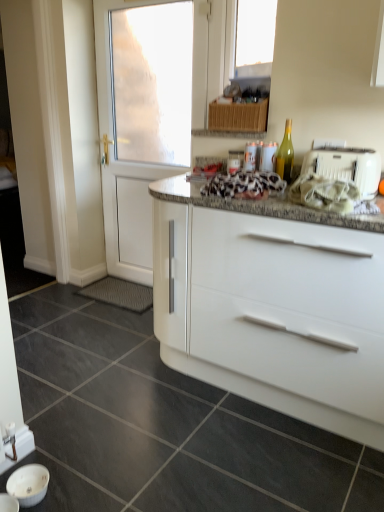
Image resolution: width=384 pixels, height=512 pixels. I want to click on granite at center, so click(x=163, y=425).

Measure the distance between point (x=236, y=58) and camera.

Point (x=236, y=58) and camera are 2.25 meters apart from each other.

The width and height of the screenshot is (384, 512). Describe the element at coordinates (108, 55) in the screenshot. I see `white glossy door at left` at that location.

The image size is (384, 512). Identify the location of white glossy door at left. (108, 55).

Locate an element on the screen. white plastic toaster at right is located at coordinates (346, 166).

The height and width of the screenshot is (512, 384). What do you see at coordinates (285, 155) in the screenshot?
I see `green glass bottle at upper right` at bounding box center [285, 155].

This screenshot has width=384, height=512. In order to click on white glossy cabinet at center in this screenshot , I will do `click(284, 314)`.

This screenshot has width=384, height=512. Find the location of `granite at center`. granite at center is located at coordinates (163, 425).

Who is more distant, green glass bottle at upper right or white glossy sink at lower left?

green glass bottle at upper right is further from the camera.

In terms of width, does green glass bottle at upper right look wider or thinner when compared to white glossy sink at lower left?

green glass bottle at upper right is thinner than white glossy sink at lower left.

Which of these two, green glass bottle at upper right or white glossy sink at lower left, is smaller?

Smaller between the two is green glass bottle at upper right.

Considering the positions of objects green glass bottle at upper right and white glossy sink at lower left in the image provided, who is more to the left, green glass bottle at upper right or white glossy sink at lower left?

white glossy sink at lower left is more to the left.

Is point (100, 499) farther from viewer compared to point (73, 386)?

That is False.

Does white glossy sink at lower left contain granite at center?

Definitely not — granite at center is not inside white glossy sink at lower left.

Could you tell me if white glossy sink at lower left is facing granite at center?

No, white glossy sink at lower left does not turn towards granite at center.

Considering the sizes of objects white glossy sink at lower left and granite at center in the image provided, who is bigger, white glossy sink at lower left or granite at center?

granite at center is bigger.

Is point (239, 333) more distant than point (292, 156)?

That is False.

Is white glossy cabinet at center next to green glass bottle at upper right and touching it?

No, white glossy cabinet at center is not with green glass bottle at upper right.

From a real-world perspective, is white glossy cabinet at center under green glass bottle at upper right?

Indeed, from a real-world perspective, white glossy cabinet at center is positioned beneath green glass bottle at upper right.

Considering the sizes of objects white glossy cabinet at center and green glass bottle at upper right in the image provided, who is thinner, white glossy cabinet at center or green glass bottle at upper right?

With smaller width is green glass bottle at upper right.

Does granite at center come in front of white glossy door at left?

Yes.

What's the angular difference between granite at center and white glossy door at left's facing directions?

The facing directions of granite at center and white glossy door at left are 90.9 degrees apart.

Between granite at center and white glossy door at left, which one appears on the right side from the viewer's perspective?

From the viewer's perspective, white glossy door at left appears more on the right side.

How many degrees apart are the facing directions of green glass bottle at upper right and white plastic toaster at right?

0.000747 degrees separate the facing orientations of green glass bottle at upper right and white plastic toaster at right.

Which object is closer to the camera, green glass bottle at upper right or white plastic toaster at right?

white plastic toaster at right.

Is green glass bottle at upper right wider or thinner than white plastic toaster at right?

In the image, green glass bottle at upper right appears to be more narrow than white plastic toaster at right.

Is green glass bottle at upper right at the right side of white plastic toaster at right?

Incorrect, green glass bottle at upper right is not on the right side of white plastic toaster at right.

From the image's perspective, is white glossy door at left on top of granite at center?

Yes, from the image's perspective, white glossy door at left is on top of granite at center.

How many degrees apart are the facing directions of white glossy door at left and granite at center?

90.9 degrees separate the facing orientations of white glossy door at left and granite at center.

Is white glossy door at left spatially inside granite at center, or outside of it?

white glossy door at left exists outside the volume of granite at center.

From a real-world perspective, which object stands above the other?

white glossy door at left, from a real-world perspective.

In the scene shown: Is transparent glass window at upper center positioned in front of white glossy door at left?

Yes.

Is point (240, 47) farther from viewer compared to point (96, 0)?

No, it is not.

Is transparent glass window at upper center far from white glossy door at left?

No.

Find the location of a particular element. The width and height of the screenshot is (384, 512). tile below the green glass bottle at upper right (from the image's perspective) is located at coordinates (67, 488).

You are a GUI agent. You are given a task and a screenshot of the screen. Output one action in this format:
    pyautogui.click(x=<x>, y=<y>)
    Task: Click on the tile lying on the left of granite at center
    
    Given the screenshot: What is the action you would take?
    pyautogui.click(x=67, y=488)

Looking at this image, which object lies nearer to the anchor point granite at center, transparent glass window at upper center or white glossy door at left?

Among the two, white glossy door at left is located nearer to granite at center.

From the image, which object appears to be farther from white plastic toaster at right, white glossy sink at lower left or transparent glass window at upper center?

Among the two, white glossy sink at lower left is located further to white plastic toaster at right.

Based on their spatial positions, is white glossy cabinet at center or white glossy door at left closer to green glass bottle at upper right?

white glossy cabinet at center.

Looking at the image, which one is located further to white glossy sink at lower left, white glossy cabinet at center or white plastic toaster at right?

white plastic toaster at right is further to white glossy sink at lower left.

Estimate the real-world distances between objects in this image. Which object is closer to white plastic toaster at right, green glass bottle at upper right or white glossy door at left?

The object closer to white plastic toaster at right is green glass bottle at upper right.

Looking at the image, which one is located further to green glass bottle at upper right, white glossy cabinet at center or white plastic toaster at right?

white glossy cabinet at center lies further to green glass bottle at upper right than the other object.

Which object lies further to the anchor point transparent glass window at upper center, white glossy sink at lower left or white glossy cabinet at center?

The object further to transparent glass window at upper center is white glossy sink at lower left.

Estimate the real-world distances between objects in this image. Which object is closer to transparent glass window at upper center, white glossy cabinet at center or green glass bottle at upper right?

green glass bottle at upper right is closer to transparent glass window at upper center.

I want to click on door between transparent glass window at upper center and granite at center vertically, so click(x=108, y=55).

The height and width of the screenshot is (512, 384). Find the location of `granite between transparent glass window at upper center and white glossy sink at lower left in the up-down direction`. granite between transparent glass window at upper center and white glossy sink at lower left in the up-down direction is located at coordinates (163, 425).

This screenshot has width=384, height=512. Identify the location of wine bottle between transparent glass window at upper center and white glossy sink at lower left in the up-down direction. (285, 155).

You are a GUI agent. You are given a task and a screenshot of the screen. Output one action in this format:
    pyautogui.click(x=<x>, y=<y>)
    Task: Click on the toaster between green glass bottle at upper right and granite at center from top to bottom
    The height and width of the screenshot is (512, 384).
    Given the screenshot: What is the action you would take?
    pyautogui.click(x=346, y=166)